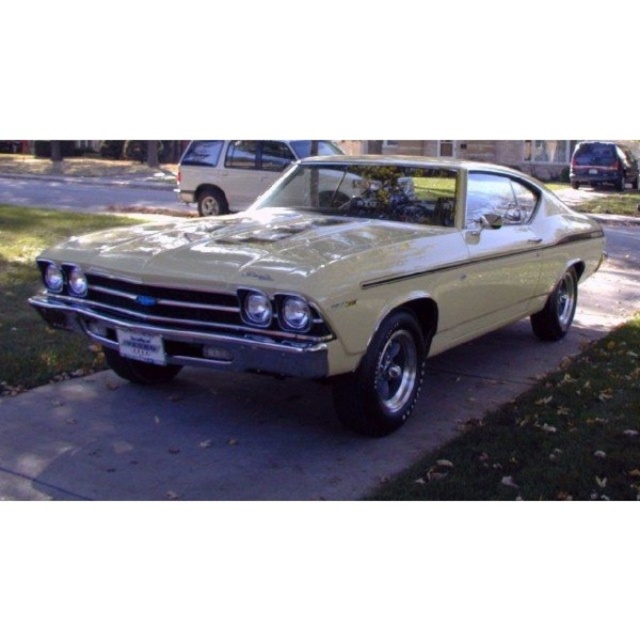
You are a delivery person trying to park your delivery van next to the metallic gold car at center and the matte black minivan at center. Which vehicle should you park behind to ensure your van doesn t block the view of the shorter vehicle?

You should park behind the matte black minivan at center because the metallic gold car at center is shorter, so parking behind the taller minivan will prevent blocking its view.

You are a photographer planning to take a photo of the matte gold car at center and the metallic gold car at center. Since you want to ensure both cars are clearly visible in the frame, which car should you focus on first to account for their sizes?

You should focus on the matte gold car at center first because it is larger in size than the metallic gold car at center, making it more prominent in the photo.